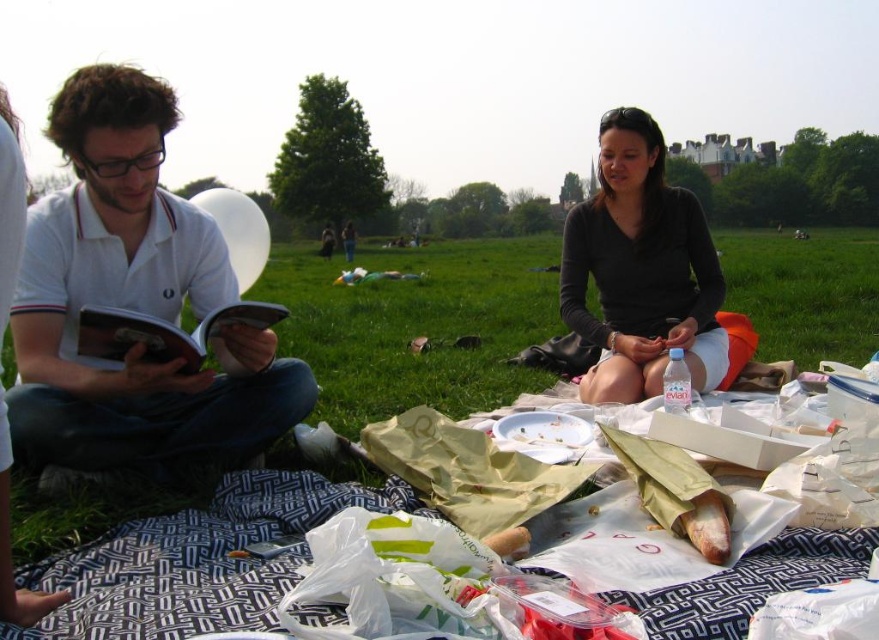
Question: Can you confirm if white cotton shirt at left is bigger than white paper bag at center?

Choices:
 (A) yes
 (B) no

Answer: (A)

Question: Among these points, which one is nearest to the camera?

Choices:
 (A) (198, 365)
 (B) (666, 339)

Answer: (A)

Question: Does white cotton polo shirt at left appear on the left side of white paper bag at center?

Choices:
 (A) yes
 (B) no

Answer: (A)

Question: Which of the following is the farthest from the observer?

Choices:
 (A) (178, 355)
 (B) (720, 513)

Answer: (A)

Question: Which is farther from the green grass at center?

Choices:
 (A) white cotton shirt at left
 (B) white cotton polo shirt at left
 (C) hardcover book at center

Answer: (B)

Question: Is the position of green grass at center less distant than that of black matte shirt at center?

Choices:
 (A) yes
 (B) no

Answer: (B)